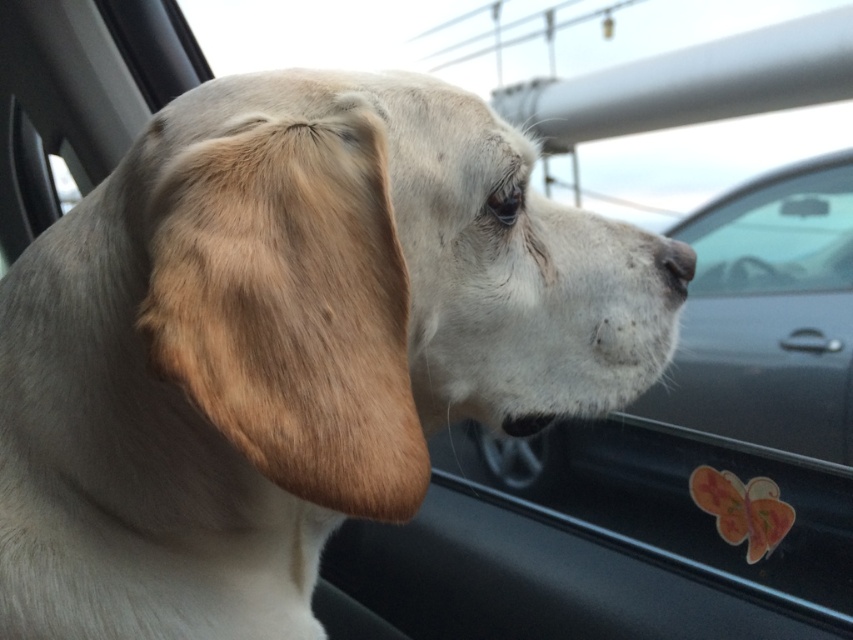
Question: Does light beige fur at center have a smaller size compared to white matte nose at center?

Choices:
 (A) yes
 (B) no

Answer: (B)

Question: Does light beige fur at center lie in front of white matte nose at center?

Choices:
 (A) no
 (B) yes

Answer: (B)

Question: Which of the following is the closest to the observer?

Choices:
 (A) white matte nose at center
 (B) light beige fur at center

Answer: (B)

Question: Can you confirm if light beige fur at center is bigger than white matte nose at center?

Choices:
 (A) yes
 (B) no

Answer: (A)